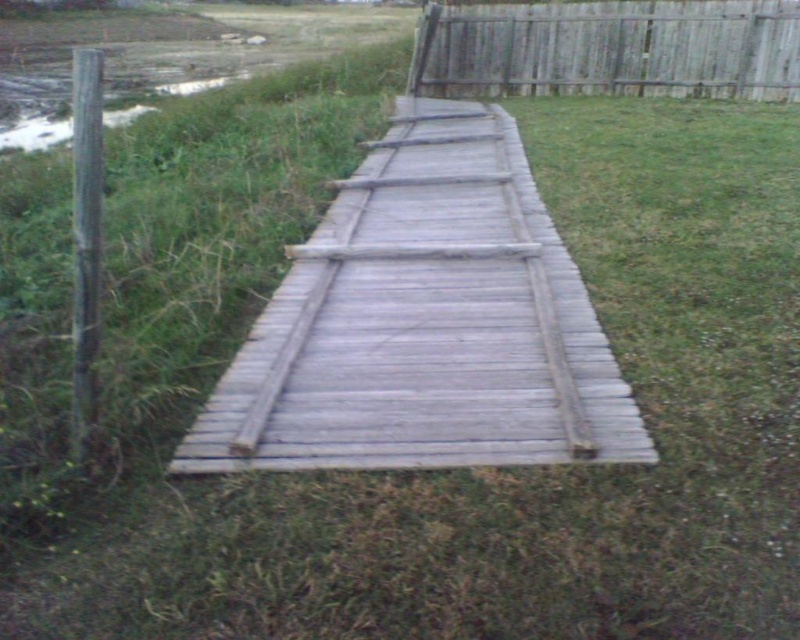
Is weathered wood bridge at center in front of weathered wood fence at upper right?

Yes, weathered wood bridge at center is in front of weathered wood fence at upper right.

The height and width of the screenshot is (640, 800). In order to click on weathered wood bridge at center in this screenshot , I will do `click(424, 323)`.